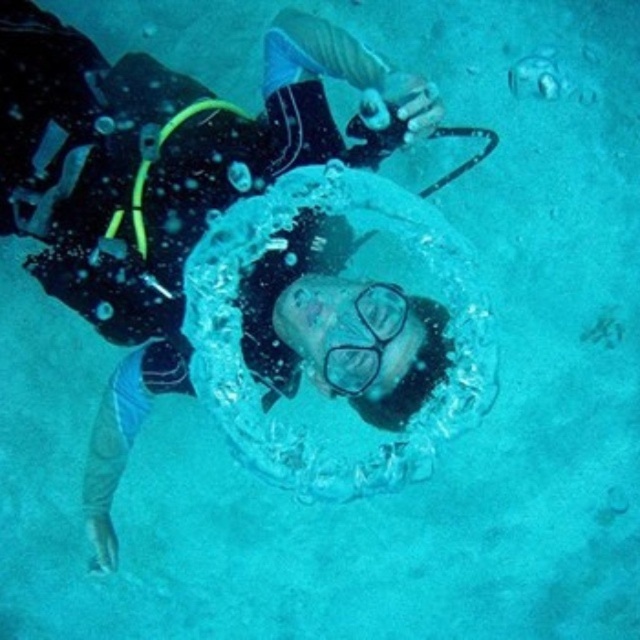
Who is higher up, transparent water at center or clear plastic goggles at center?

transparent water at center

Is point (216, 317) less distant than point (339, 346)?

No, it is behind (339, 346).

Is point (300, 195) closer to viewer compared to point (365, 372)?

No.

This screenshot has height=640, width=640. In order to click on transparent water at center in this screenshot , I will do `click(344, 333)`.